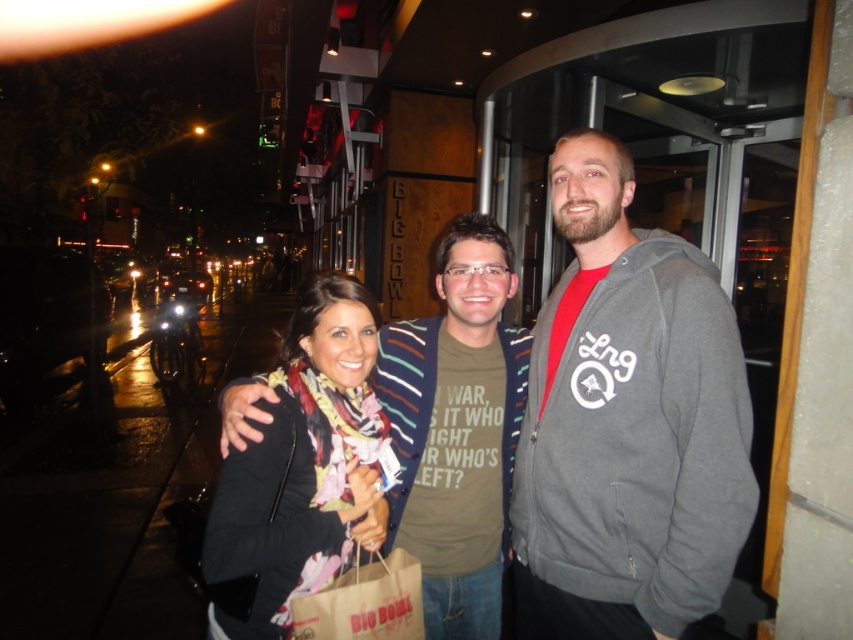
Question: Among these points, which one is nearest to the camera?

Choices:
 (A) (724, 573)
 (B) (405, 400)
 (C) (225, 616)
 (D) (544, 346)

Answer: (A)

Question: Can you confirm if multicolored scarf at center is positioned above black textured scarf at center?

Choices:
 (A) no
 (B) yes

Answer: (B)

Question: Which of the following is the closest to the observer?

Choices:
 (A) (569, 301)
 (B) (708, 324)
 (C) (306, 408)

Answer: (B)

Question: Does multicolored scarf at center have a lesser width compared to matte brown sweater at center?

Choices:
 (A) no
 (B) yes

Answer: (B)

Question: Is multicolored scarf at center above matte brown sweater at center?

Choices:
 (A) no
 (B) yes

Answer: (B)

Question: Considering the real-world distances, which object is farthest from the multicolored scarf at center?

Choices:
 (A) matte brown sweater at center
 (B) gray fleece hoodie at right

Answer: (A)